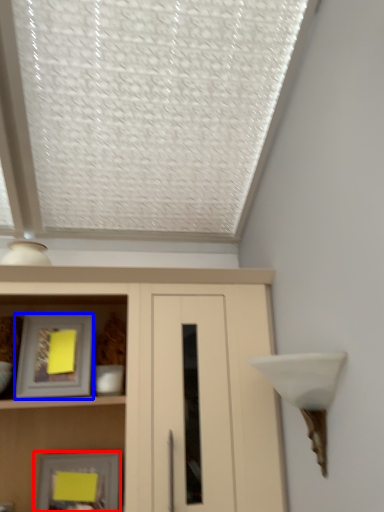
Question: Which of the following is the closest to the observer, picture frame (highlighted by a red box) or picture frame (highlighted by a blue box)?

Choices:
 (A) picture frame
 (B) picture frame

Answer: (B)